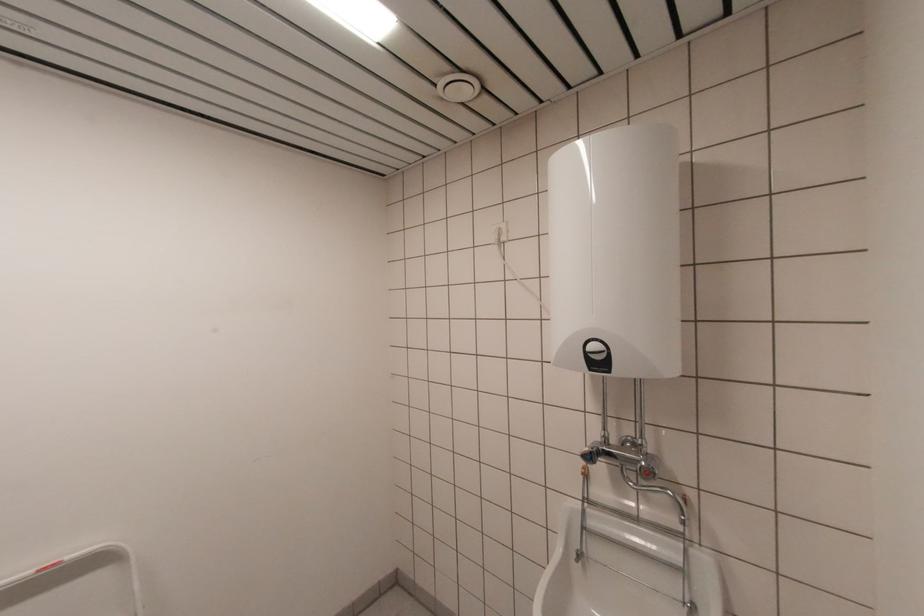
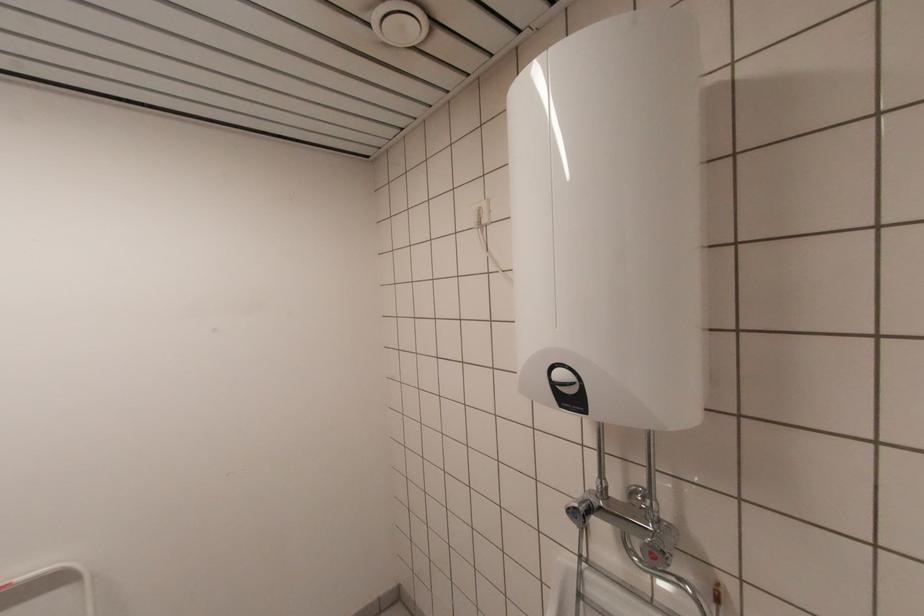
Question: The camera is either moving clockwise (left) or counter-clockwise (right) around the object. The first image is from the beginning of the video and the second image is from the end. Is the camera moving left or right when shooting the video?

Choices:
 (A) Left
 (B) Right

Answer: (B)